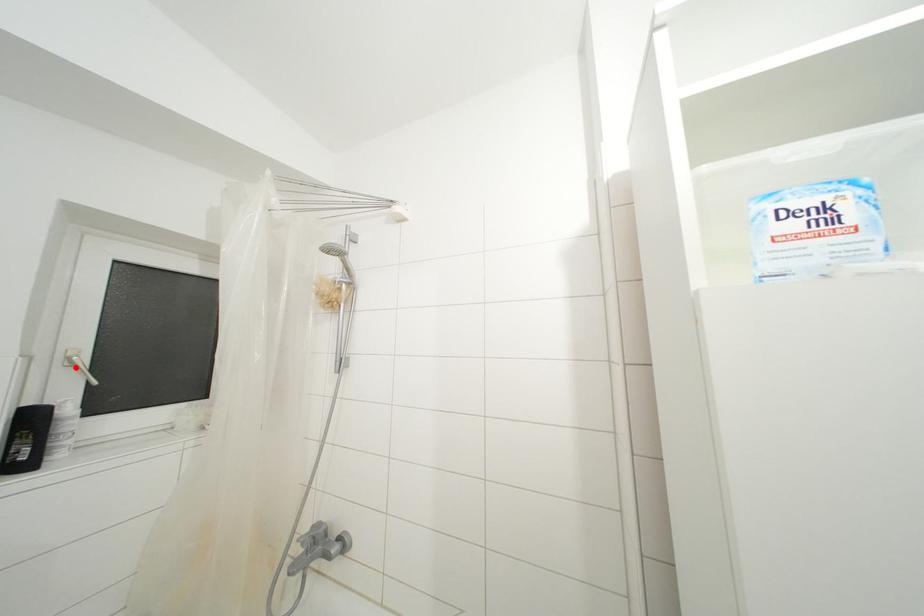
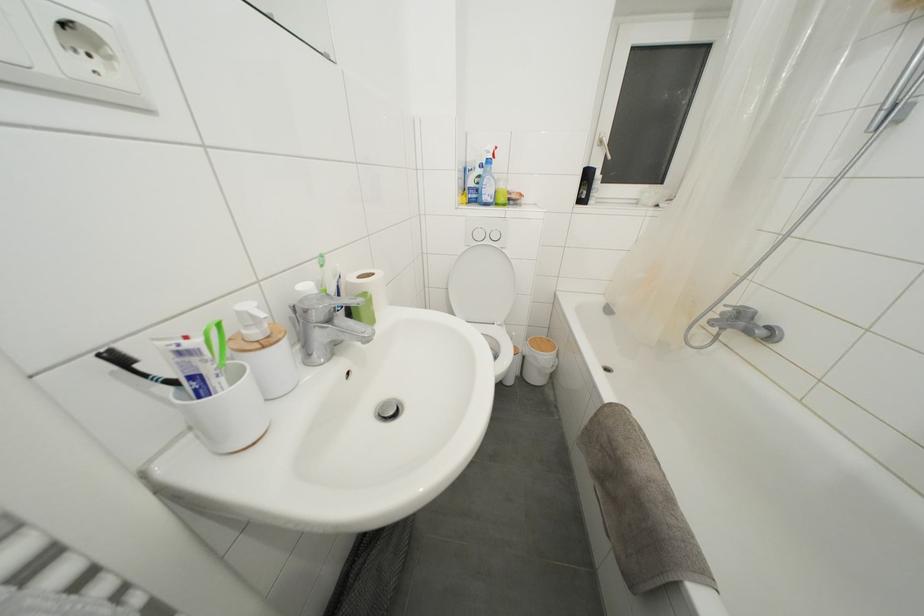
Where in the second image is the point corresponding to the highlighted location from the first image?

(604, 148)